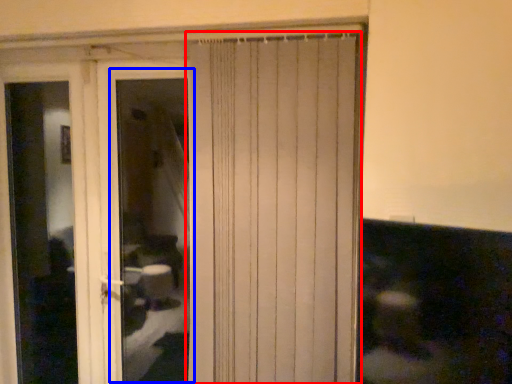
Question: Which object is closer to the camera taking this photo, curtain (highlighted by a red box) or window (highlighted by a blue box)?

Choices:
 (A) curtain
 (B) window

Answer: (A)